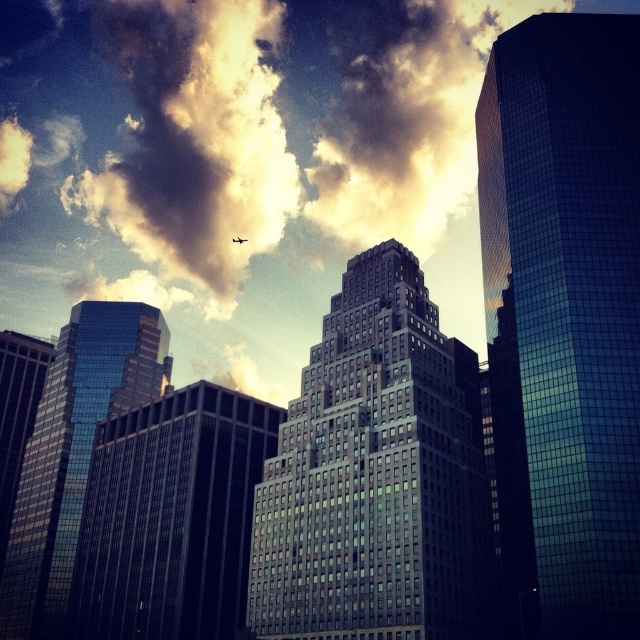
Is glossy glass skyscraper at upper right to the right of matte glass building at center from the viewer's perspective?

Correct, you'll find glossy glass skyscraper at upper right to the right of matte glass building at center.

Between glossy glass skyscraper at upper right and matte glass building at center, which one is positioned lower?

Positioned lower is matte glass building at center.

Which is in front, point (518, 380) or point (324, 424)?

Point (518, 380)

Locate an element on the screen. glossy glass skyscraper at upper right is located at coordinates (564, 314).

Between glossy glass skyscraper at upper right and glassy skyscraper at center, which one is positioned higher?

glossy glass skyscraper at upper right

Does glossy glass skyscraper at upper right appear under glassy skyscraper at center?

Incorrect, glossy glass skyscraper at upper right is not positioned below glassy skyscraper at center.

Identify the location of glossy glass skyscraper at upper right. The height and width of the screenshot is (640, 640). (564, 314).

The width and height of the screenshot is (640, 640). I want to click on glossy glass skyscraper at upper right, so click(x=564, y=314).

Who is more distant from viewer, [324,620] or [272,416]?

The point [272,416] is more distant.

Who is lower down, matte glass building at center or glassy skyscraper at center?

Positioned lower is glassy skyscraper at center.

Is point (284, 573) positioned before point (115, 580)?

Yes, it is.

Where is `matte glass building at center`? The width and height of the screenshot is (640, 640). matte glass building at center is located at coordinates (376, 476).